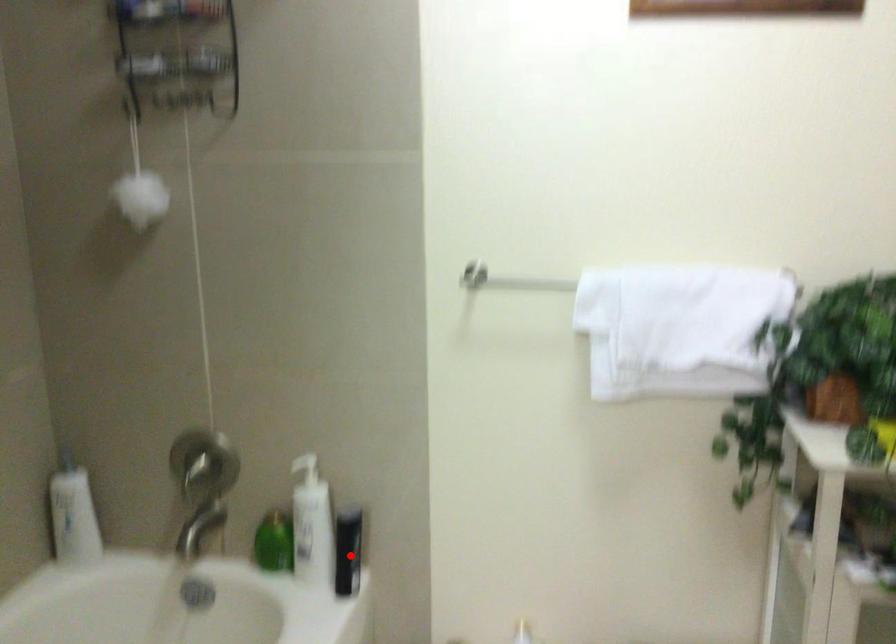
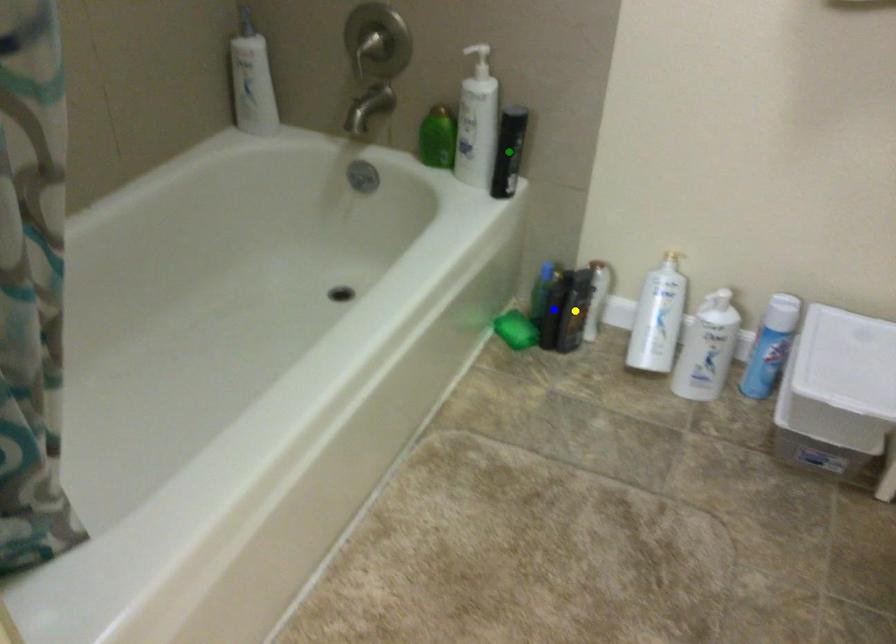
Question: I am providing you with two images of the same scene from different viewpoints. A red point is marked on the first image. You are given multiple points on the second image. Which point in image 2 represents the same 3d spot as the red point in image 1?

Choices:
 (A) yellow point
 (B) blue point
 (C) green point

Answer: (C)